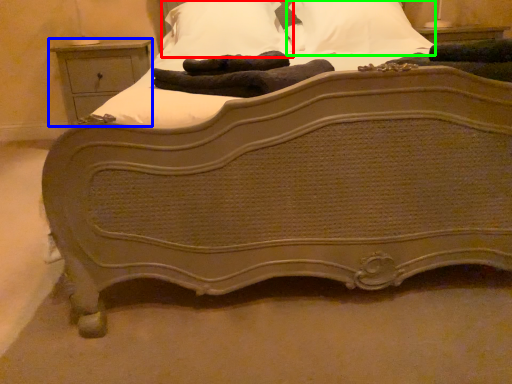
Question: Which is farther away from pillow (highlighted by a red box)? nightstand (highlighted by a blue box) or pillow (highlighted by a green box)?

Choices:
 (A) nightstand
 (B) pillow

Answer: (A)